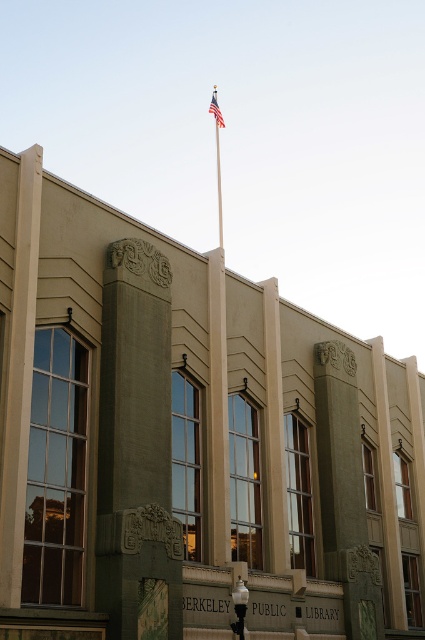
Question: Is polished metal flag pole at upper center to the right of american flag at upper center from the viewer's perspective?

Choices:
 (A) no
 (B) yes

Answer: (B)

Question: Can you confirm if polished metal flag pole at upper center is positioned below american flag at upper center?

Choices:
 (A) yes
 (B) no

Answer: (A)

Question: Can you confirm if polished metal flag pole at upper center is positioned to the right of american flag at upper center?

Choices:
 (A) no
 (B) yes

Answer: (B)

Question: Among these points, which one is nearest to the camera?

Choices:
 (A) (221, 124)
 (B) (226, 413)

Answer: (B)

Question: Which point is closer to the camera?

Choices:
 (A) polished metal flag pole at upper center
 (B) american flag at upper center

Answer: (A)